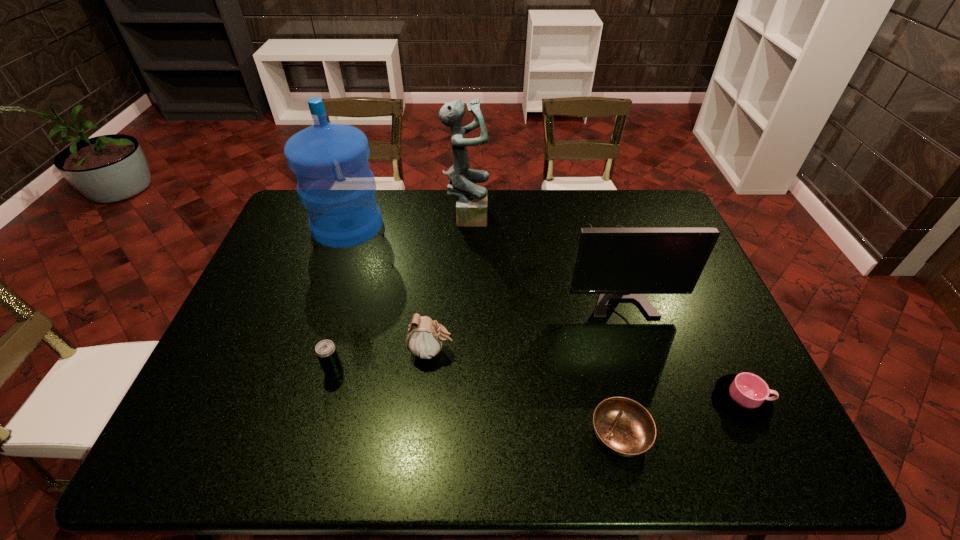
Where is `free point located on the front-facing side of the pouch`? free point located on the front-facing side of the pouch is located at coordinates (532, 351).

At what (x,y) coordinates should I click in order to perform the action: click on vacant space located on the left of the beer can. Please return your answer as a coordinate pair (x, y). This screenshot has height=540, width=960. Looking at the image, I should click on (269, 372).

Locate an element on the screen. The image size is (960, 540). vacant region located on the left of the shortest object is located at coordinates (527, 434).

Find the location of a particular element. water jug that is at the far edge is located at coordinates 335,184.

Where is `sculpture that is at the far edge`? Image resolution: width=960 pixels, height=540 pixels. sculpture that is at the far edge is located at coordinates (471, 205).

At what (x,y) coordinates should I click in order to perform the action: click on computer monitor present at the far edge. Please return your answer as a coordinate pair (x, y). This screenshot has width=960, height=540. Looking at the image, I should click on (621, 263).

Identify the location of object that is at the near edge. (624, 427).

This screenshot has height=540, width=960. Identify the location of object present at the left edge. (335, 184).

Where is `computer monitor situated at the right edge`? This screenshot has width=960, height=540. computer monitor situated at the right edge is located at coordinates (621, 263).

The width and height of the screenshot is (960, 540). Identify the location of cup situated at the right edge. (745, 396).